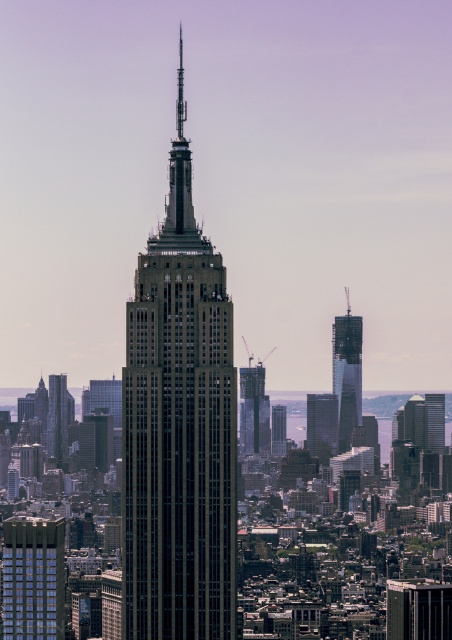
Is point (205, 406) more distant than point (320, 458)?

No, it is not.

Find the location of a particular element. dark gray stone skyscraper at center is located at coordinates (178, 428).

What are the coordinates of `dark gray stone skyscraper at center` in the screenshot? It's located at point(178,428).

Is metallic glass skyscraper at center shorter than glassy reflective skyscraper at right?

Correct, metallic glass skyscraper at center is not as tall as glassy reflective skyscraper at right.

Can you confirm if metallic glass skyscraper at center is taller than glassy reflective skyscraper at right?

No.

This screenshot has width=452, height=640. Find the location of `metallic glass skyscraper at center`. metallic glass skyscraper at center is located at coordinates (418, 609).

Which is more to the left, dark gray stone skyscraper at center or blue glass skyscraper at lower left?

Positioned to the left is blue glass skyscraper at lower left.

Which is below, dark gray stone skyscraper at center or blue glass skyscraper at lower left?

blue glass skyscraper at lower left

Describe the element at coordinates (178, 428) in the screenshot. I see `dark gray stone skyscraper at center` at that location.

You are a GUI agent. You are given a task and a screenshot of the screen. Output one action in this format:
    pyautogui.click(x=<x>, y=<y>)
    Task: Click on the dark gray stone skyscraper at center
    The height and width of the screenshot is (640, 452).
    Given the screenshot: What is the action you would take?
    pyautogui.click(x=178, y=428)